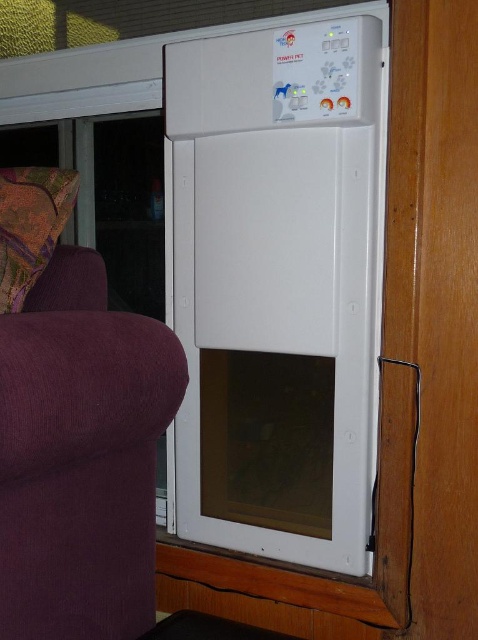
At what (x,y) coordinates should I click in order to perform the action: click on purple fabric couch at left. Please return your answer as a coordinate pair (x, y). The height and width of the screenshot is (640, 478). Looking at the image, I should click on (80, 456).

Between purple fabric couch at left and multicolored fabric pillow at left, which one has less height?

Answer: multicolored fabric pillow at left

Locate an element on the screen. The image size is (478, 640). purple fabric couch at left is located at coordinates (80, 456).

Does white plastic pet door at center have a greater height compared to multicolored fabric pillow at left?

Yes, white plastic pet door at center is taller than multicolored fabric pillow at left.

Is point (365, 400) behind point (25, 173)?

Yes, it is.

Identify the location of white plastic pet door at center. (278, 285).

Does white plastic pet door at center appear under purple fabric couch at left?

No.

Can you confirm if white plastic pet door at center is positioned to the right of purple fabric couch at left?

Correct, you'll find white plastic pet door at center to the right of purple fabric couch at left.

Describe the element at coordinates (278, 285) in the screenshot. The height and width of the screenshot is (640, 478). I see `white plastic pet door at center` at that location.

I want to click on white plastic pet door at center, so click(x=278, y=285).